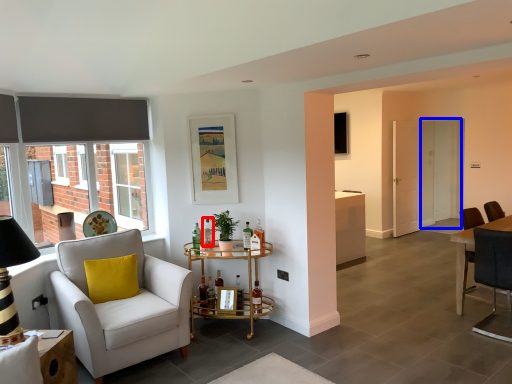
Question: Which object is further to the camera taking this photo, bottle (highlighted by a red box) or screen door (highlighted by a blue box)?

Choices:
 (A) bottle
 (B) screen door

Answer: (B)